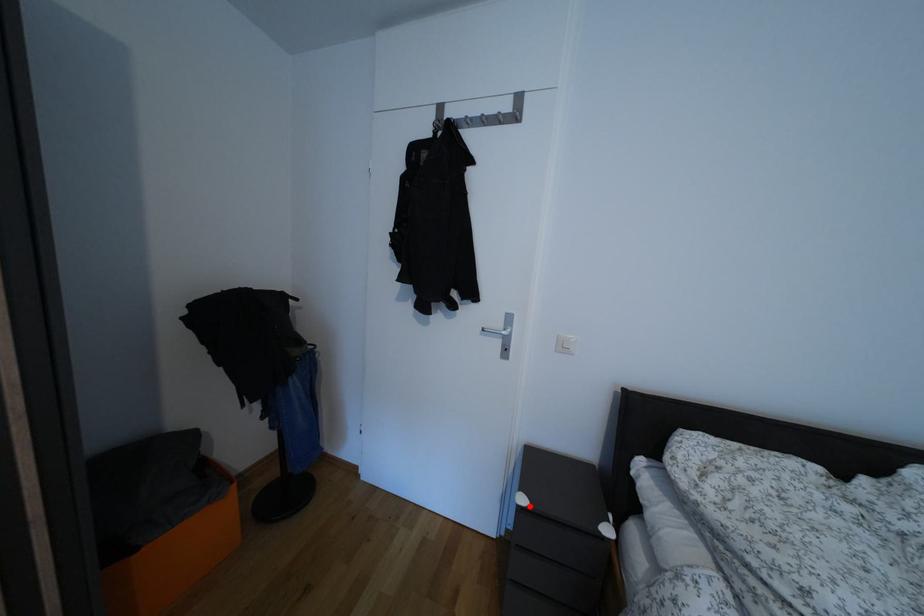
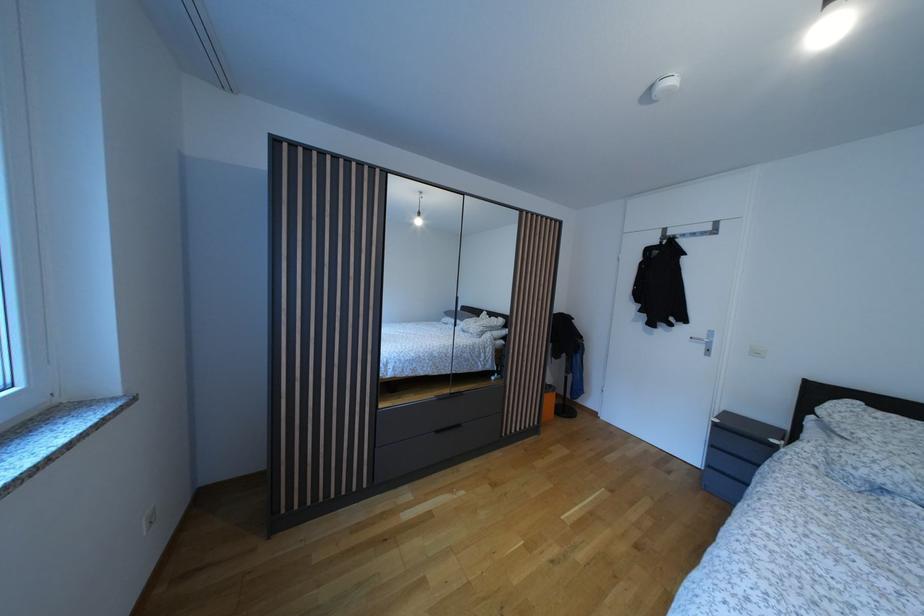
Find the pixel in the second image that matches the highlighted location in the first image.

(723, 427)